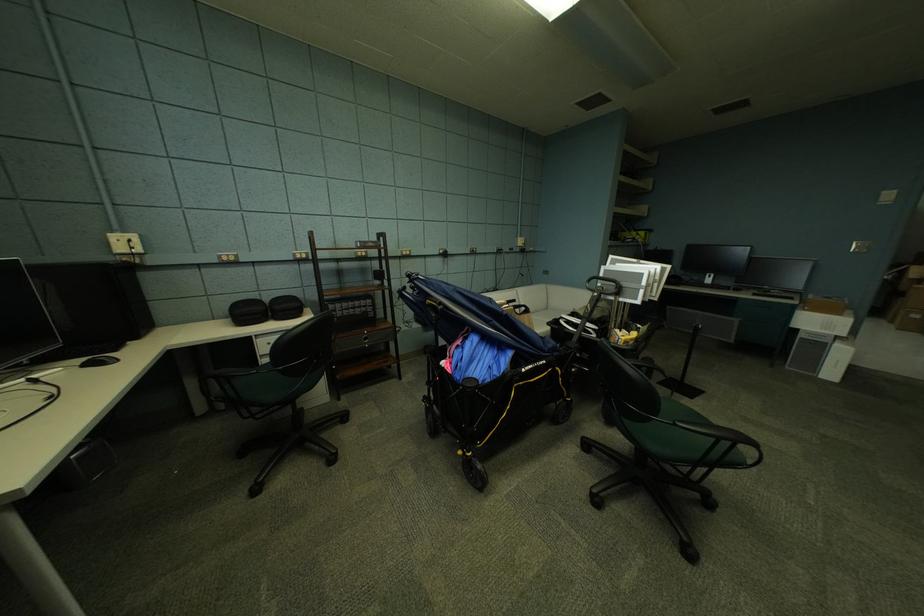
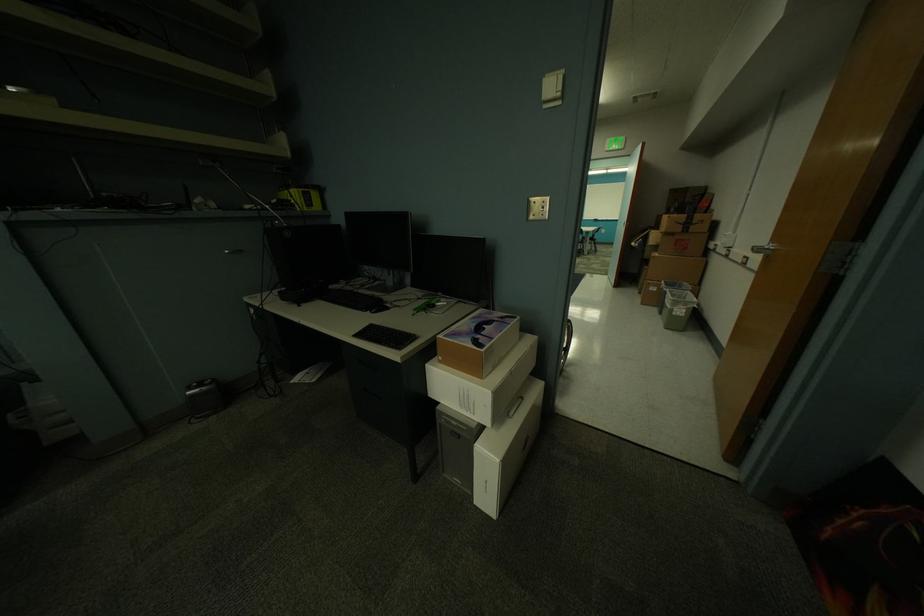
Which direction would the cameraman need to move to produce the second image?

The cameraman walked toward right, forward.